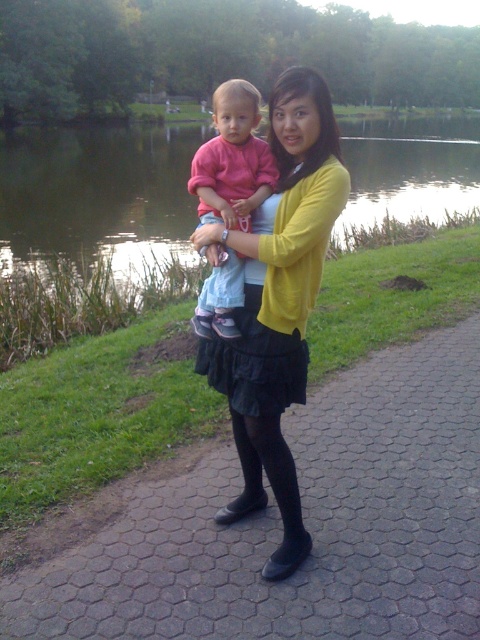
Find the location of a particular element. The width and height of the screenshot is (480, 640). glossy water at center is located at coordinates (96, 195).

Which is more to the left, glossy water at center or yellow matte sweater at center?

From the viewer's perspective, glossy water at center appears more on the left side.

Where is `glossy water at center`? glossy water at center is located at coordinates 96,195.

Find the location of a particular element. Image resolution: width=480 pixels, height=640 pixels. glossy water at center is located at coordinates (96, 195).

Between glossy water at center and matte pink shirt at center, which one is positioned lower?

Positioned lower is matte pink shirt at center.

This screenshot has height=640, width=480. What do you see at coordinates (96, 195) in the screenshot?
I see `glossy water at center` at bounding box center [96, 195].

The width and height of the screenshot is (480, 640). I want to click on glossy water at center, so (x=96, y=195).

Is point (336, 483) closer to viewer compared to point (99, 179)?

Yes, point (336, 483) is closer to viewer.

Which is in front, point (414, 365) or point (387, 209)?

Positioned in front is point (414, 365).

I want to click on black tights at center, so click(279, 524).